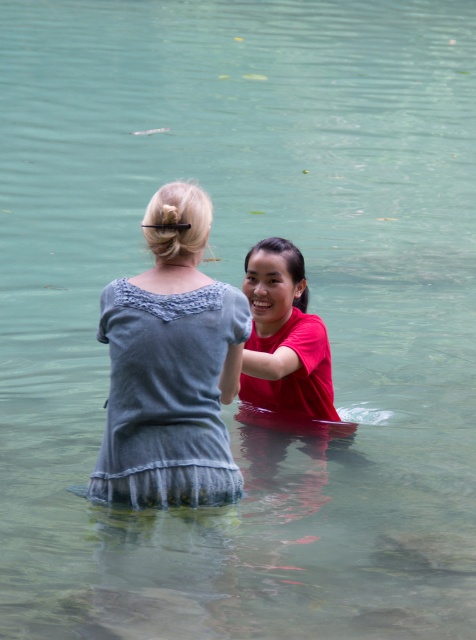
You are trying to locate the denim dress at center and the red matte shirt at center in the image. Which one is positioned to the left of the other?

The denim dress at center is positioned to the left of the red matte shirt at center.

You are a photographer trying to capture the denim dress at center. You need to place a marker at the exact location of point (168, 396) to ensure proper framing. According to the scene description, where should you place the marker?

The point (168, 396) is on the denim dress at center, so place the marker there to frame the denim dress at center correctly.

You are standing at the edge of the water and see the denim dress at center. If you want to reach it without getting into the water, can you? Explain why or why not.

The denim dress at center is 4.79 meters from the viewer. Since you are at the edge of the water and the dress is in the water, you would need to enter the water to reach it. However, if there is a path or structure around the water that allows access without entering, you might be able to. But based on the given information, the dress is 4.79 meters away, so unless you can extend your reach that far, you cannot reach it without getting into the water.